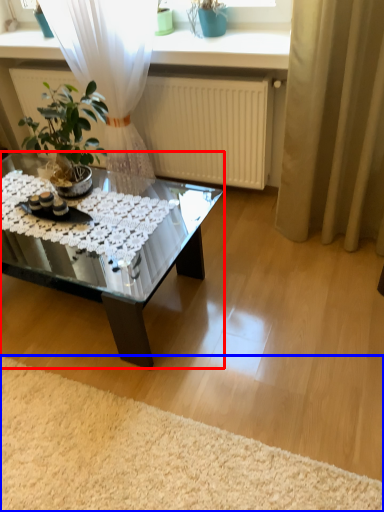
Question: Which of the following is the farthest to the observer, coffee table (highlighted by a red box) or plain (highlighted by a blue box)?

Choices:
 (A) coffee table
 (B) plain

Answer: (A)